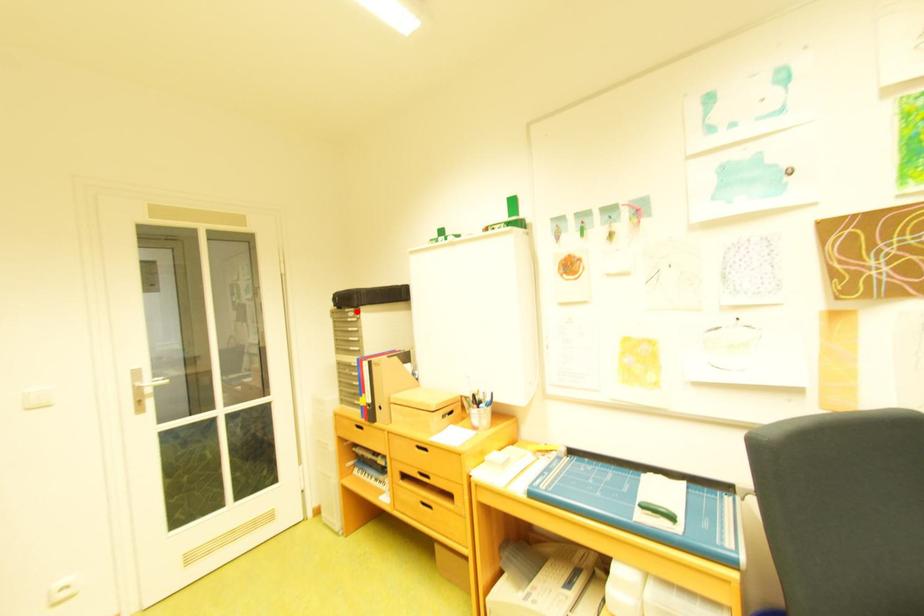
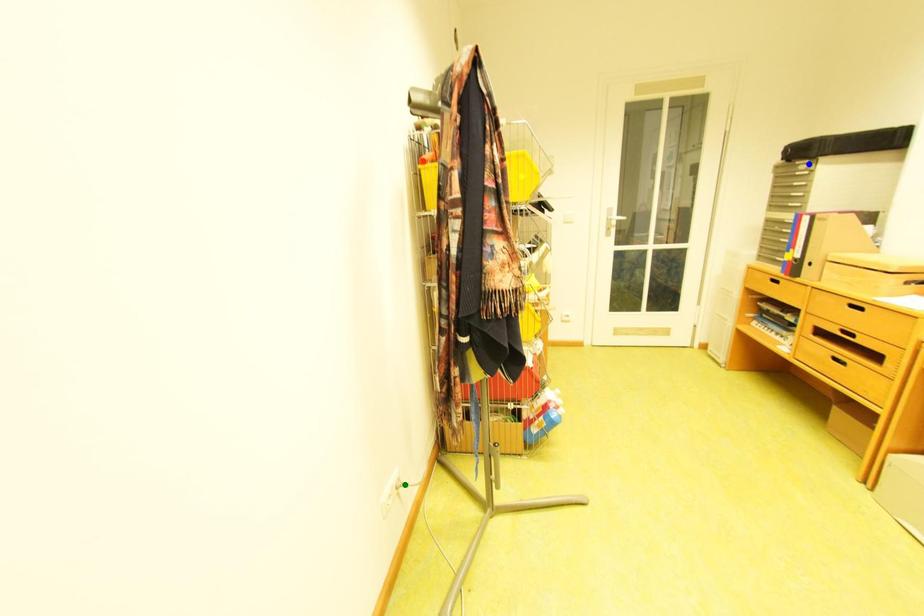
Question: I am providing you with two images of the same scene from different viewpoints. A red point is marked on the first image. You are given multiple points on the second image. Which spot in image 2 lines up with the point in image 1?

Choices:
 (A) yellow point
 (B) green point
 (C) blue point

Answer: (C)